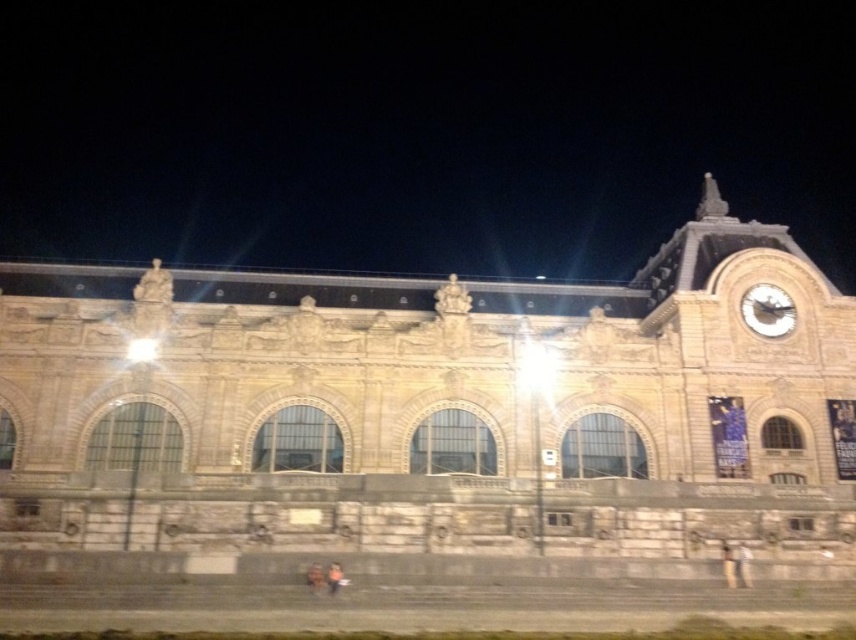
You are standing in front of the grand historic building at night. You see the stone clock tower at center and the orange fabric bag at lower center. Which object is located higher up in the image?

The stone clock tower at center is positioned over the orange fabric bag at lower center, so it is located higher up in the image.

You are a photographer standing in front of the grand historic building at night. You see the dark brown leather jacket at lower center and the orange fabric bag at lower center. Which object is wider?

The dark brown leather jacket at lower center is wider than the orange fabric bag at lower center.

You are standing in front of the grand historic building at night. You see a dark brown leather jacket at lower center and an orange fabric bag at lower center. Which item is covering the other one?

The dark brown leather jacket at lower center is positioned over the orange fabric bag at lower center, so the jacket is covering the bag.